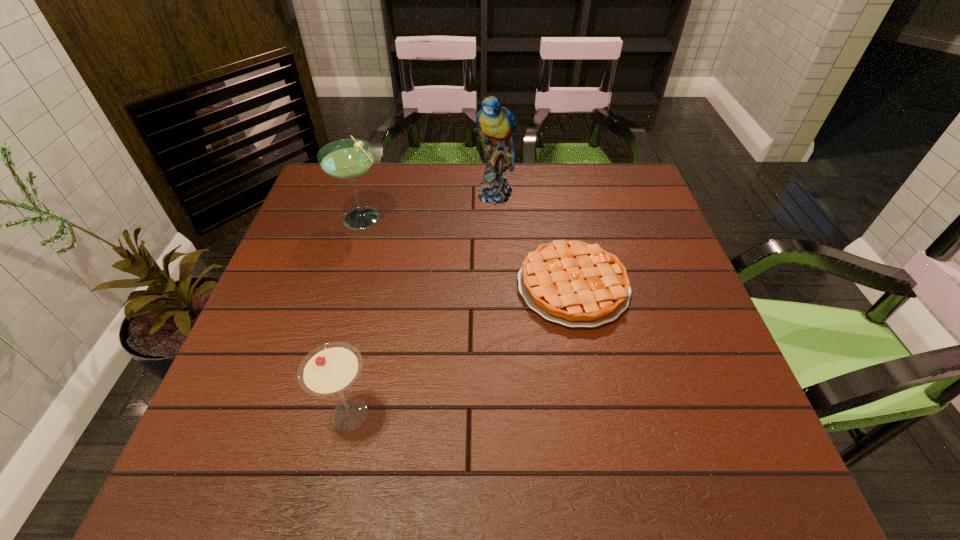
Where is `vacant space that's between the taller martini and the tallest object`? Image resolution: width=960 pixels, height=540 pixels. vacant space that's between the taller martini and the tallest object is located at coordinates (429, 205).

The width and height of the screenshot is (960, 540). Find the location of `vacant space that is in between the shorter martini and the tallest object`. vacant space that is in between the shorter martini and the tallest object is located at coordinates (422, 304).

Locate which object is the second closest to the shorter martini. Please provide its 2D coordinates. Your answer should be formatted as a tuple, i.e. [(x, y)], where the tuple contains the x and y coordinates of a point satisfying the conditions above.

[(347, 159)]

Locate an element on the screen. This screenshot has height=540, width=960. object that is the second nearest to the parrot is located at coordinates (347, 159).